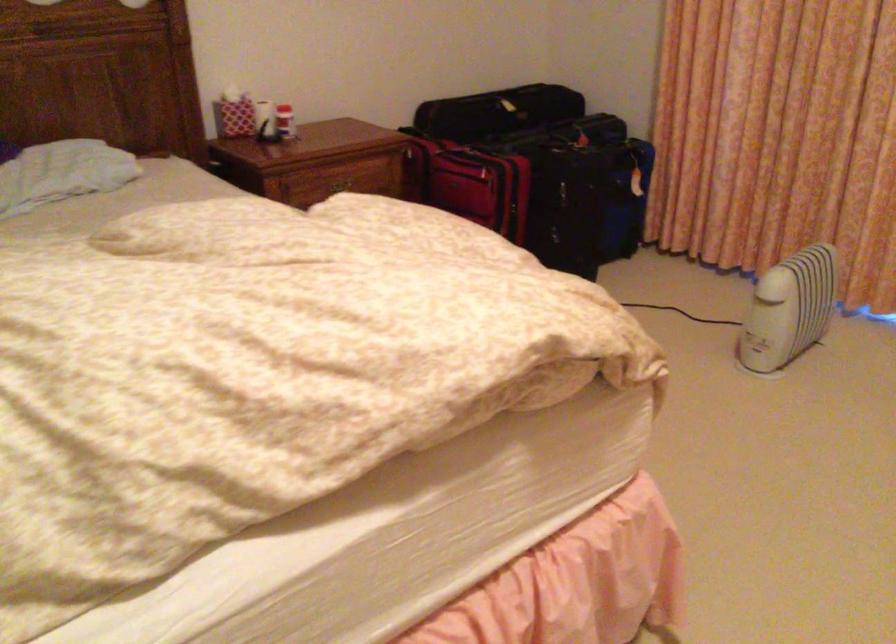
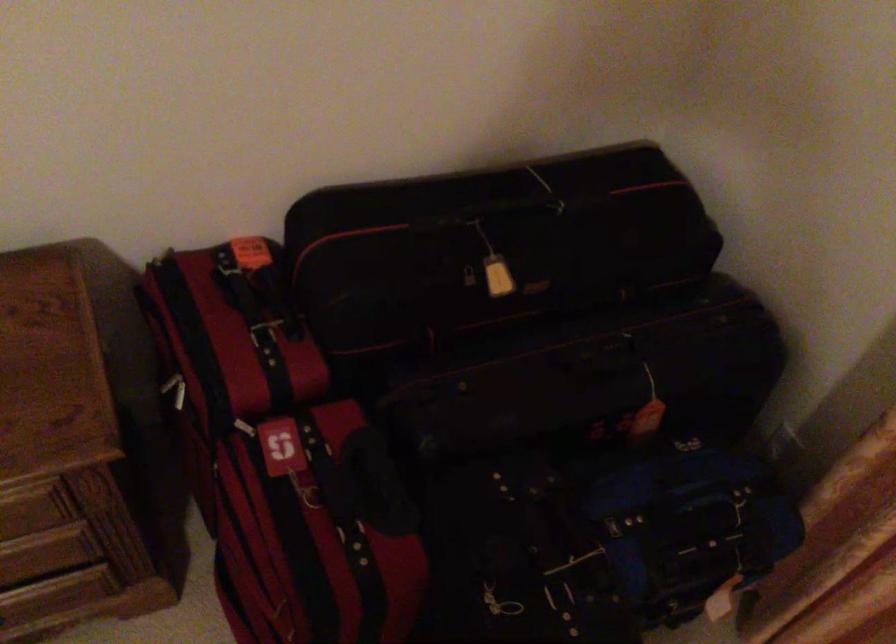
Where in the second image is the point corresponding to (x=530, y=122) from the first image?

(527, 357)